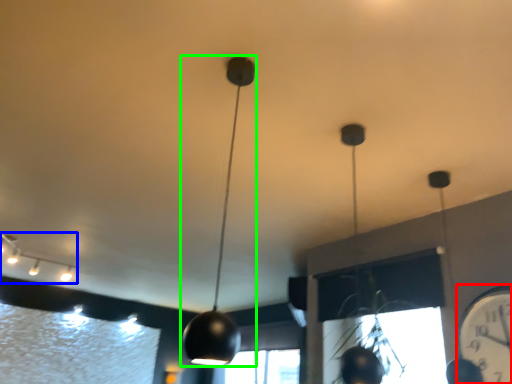
Question: Estimate the real-world distances between objects in this image. Which object is closer to clock (highlighted by a red box), lamp (highlighted by a blue box) or lamp (highlighted by a green box)?

Choices:
 (A) lamp
 (B) lamp

Answer: (B)